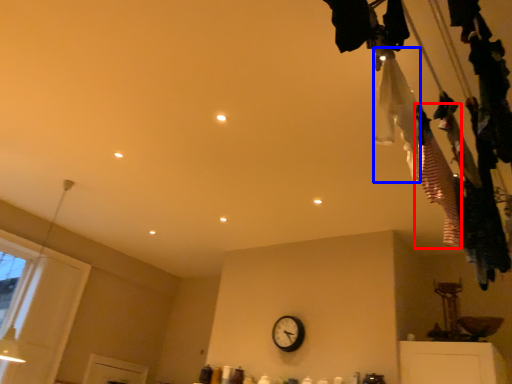
Question: Which object appears farthest to the camera in this image, clothing (highlighted by a red box) or clothing (highlighted by a blue box)?

Choices:
 (A) clothing
 (B) clothing

Answer: (A)